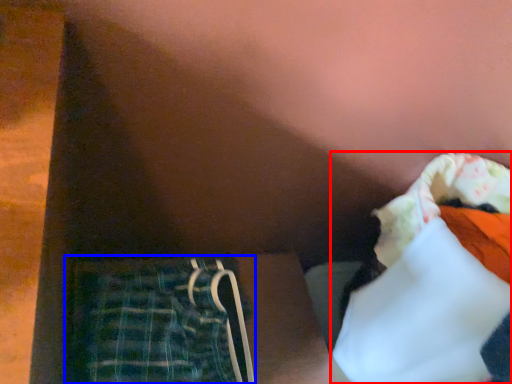
Question: Among these objects, which one is nearest to the camera, clothing (highlighted by a red box) or trousers (highlighted by a blue box)?

Choices:
 (A) clothing
 (B) trousers

Answer: (A)